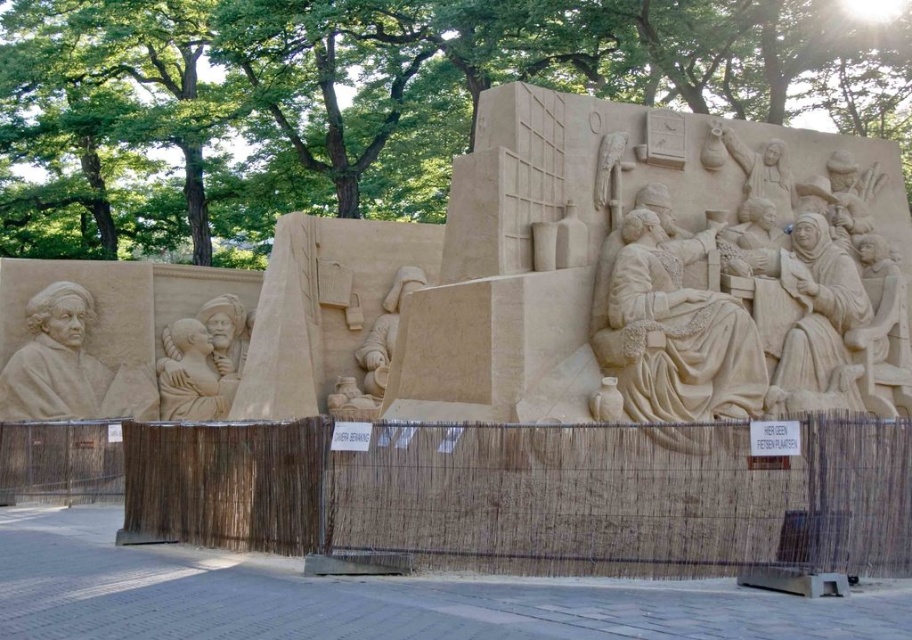
Question: Which of the following is the farthest from the observer?

Choices:
 (A) light beige sand sculpture at center
 (B) smooth sand sculpture at center
 (C) sand relief figures at right
 (D) smooth beige bust at left

Answer: (B)

Question: Which of these objects is positioned closest to the smooth sand sculpture at center?

Choices:
 (A) light beige sand sculpture at center
 (B) smooth beige figure at center
 (C) smooth beige bust at left

Answer: (C)

Question: In this image, where is sand relief figures at right located relative to smooth beige figure at center?

Choices:
 (A) above
 (B) below

Answer: (A)

Question: Does light beige sand sculpture at center lie in front of smooth sand sculpture at center?

Choices:
 (A) no
 (B) yes

Answer: (B)

Question: Which point appears farthest from the camera in this image?

Choices:
 (A) (75, 284)
 (B) (803, 356)

Answer: (A)

Question: Can you confirm if light beige sand sculpture at center is smaller than smooth beige bust at left?

Choices:
 (A) yes
 (B) no

Answer: (B)